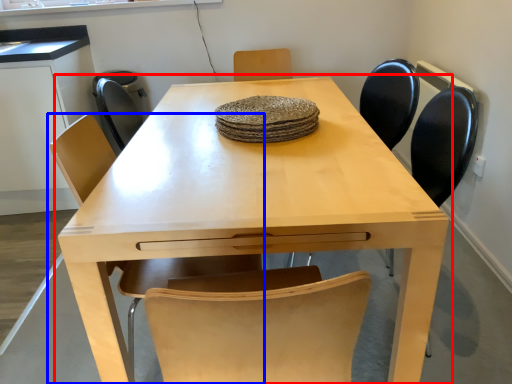
Question: Which point is further to the camera, table (highlighted by a red box) or chair (highlighted by a blue box)?

Choices:
 (A) table
 (B) chair

Answer: (B)